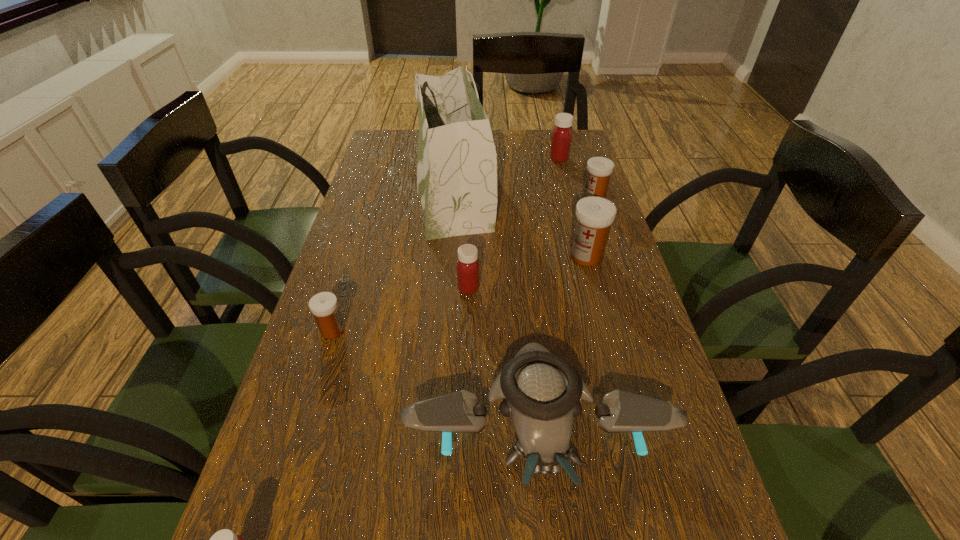
Where is `grocery bag situated at the far edge`? Image resolution: width=960 pixels, height=540 pixels. grocery bag situated at the far edge is located at coordinates (457, 161).

This screenshot has width=960, height=540. I want to click on medicine situated at the far edge, so click(x=561, y=139).

Locate an element on the screen. The width and height of the screenshot is (960, 540). grocery bag at the left edge is located at coordinates (457, 161).

Locate an element on the screen. medicine located in the left edge section of the desktop is located at coordinates (324, 306).

Find the location of a particular element. The height and width of the screenshot is (540, 960). drone located at the right edge is located at coordinates (541, 391).

Find the location of a particular element. The image size is (960, 540). object positioned at the far left corner is located at coordinates (457, 161).

Identify the location of object that is at the far right corner. point(561,139).

This screenshot has width=960, height=540. What are the coordinates of `blank area at the far edge` in the screenshot? It's located at coord(512,150).

At what (x,y) coordinates should I click in order to perform the action: click on free location at the left edge of the desktop. Please return your answer as a coordinate pair (x, y). Image resolution: width=960 pixels, height=540 pixels. Looking at the image, I should click on (325, 374).

You are a GUI agent. You are given a task and a screenshot of the screen. Output one action in this format:
    pyautogui.click(x=<x>, y=<y>)
    Task: Click on the vacant space at the right edge of the desktop
    This screenshot has width=960, height=540.
    Given the screenshot: What is the action you would take?
    pyautogui.click(x=585, y=266)